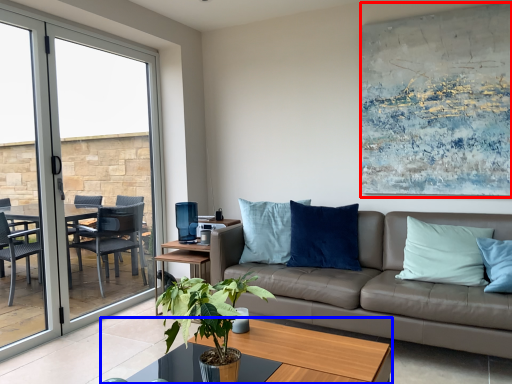
Question: Which point is further to the camera, picture frame (highlighted by a red box) or coffee table (highlighted by a blue box)?

Choices:
 (A) picture frame
 (B) coffee table

Answer: (A)